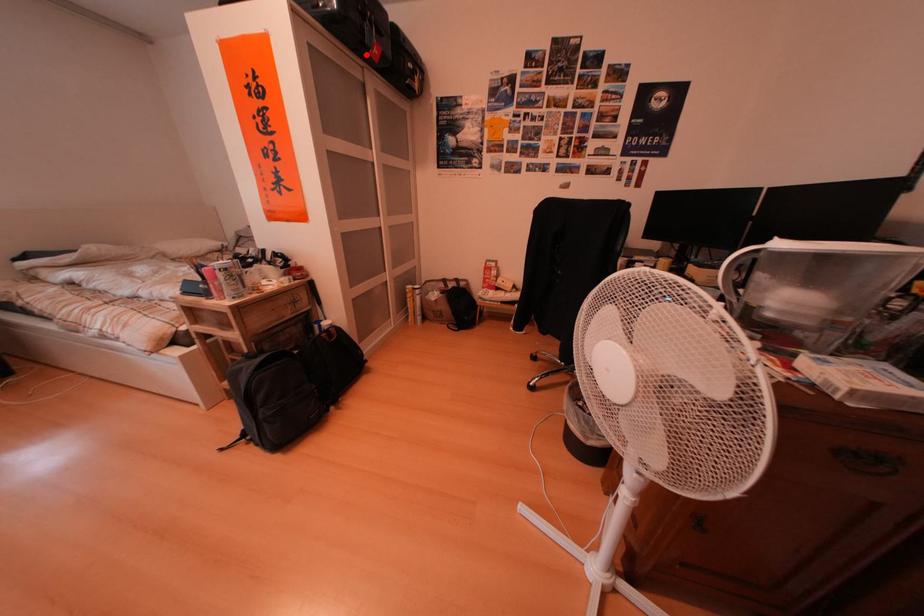
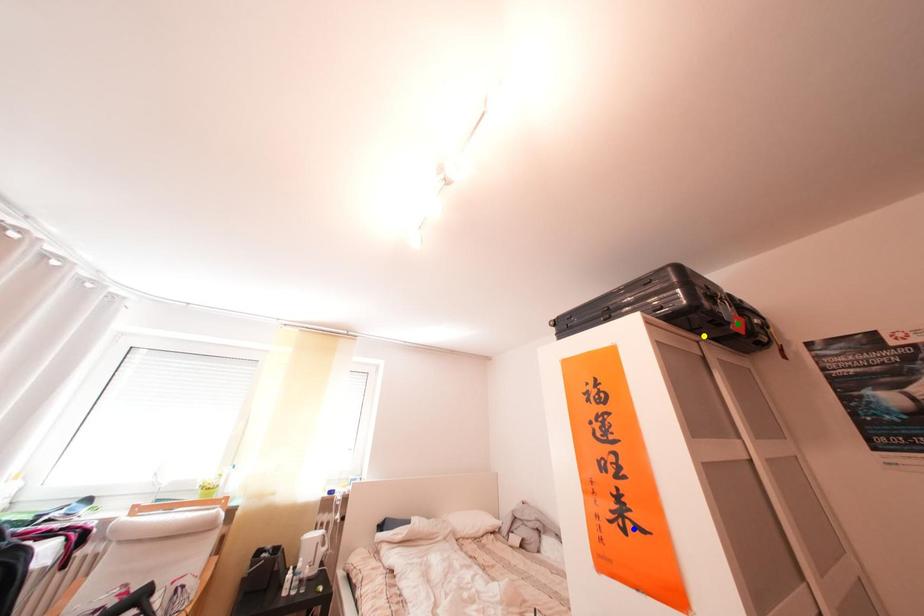
Question: I am providing you with two images of the same scene from different viewpoints. A red point is marked on the first image. You are given multiple points on the second image. Can you choose the point in image 2 that corresponds to the point in image 1?

Choices:
 (A) yellow point
 (B) green point
 (C) blue point

Answer: (A)